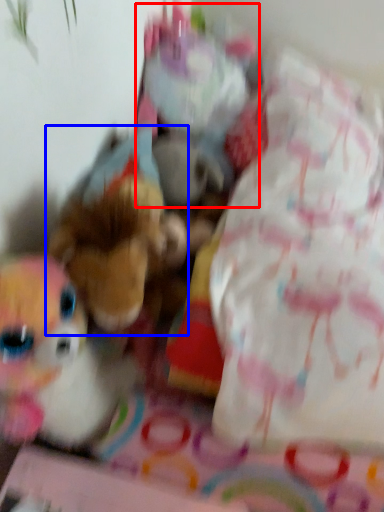
Question: Among these objects, which one is farthest to the camera, toy (highlighted by a red box) or toy (highlighted by a blue box)?

Choices:
 (A) toy
 (B) toy

Answer: (A)